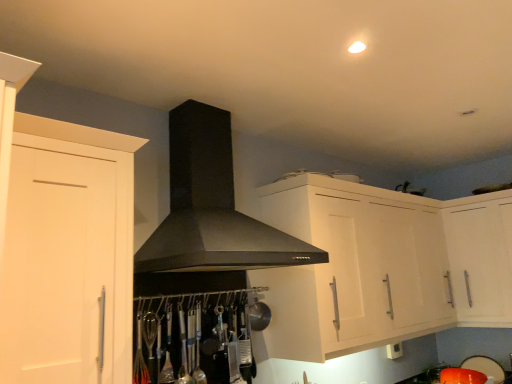
Question: Is white glossy cabinet at upper right, the 2th cabinetry in the left-to-right sequence, bigger than black matte fume hood at center?

Choices:
 (A) no
 (B) yes

Answer: (B)

Question: Does white glossy cabinet at upper right, the 2th cabinetry in the left-to-right sequence, have a smaller size compared to black matte fume hood at center?

Choices:
 (A) no
 (B) yes

Answer: (A)

Question: Is white glossy cabinet at upper right, which is the first cabinetry in back-to-front order, wider than black matte fume hood at center?

Choices:
 (A) yes
 (B) no

Answer: (B)

Question: Is white glossy cabinet at upper right, which is the first cabinetry in back-to-front order, not inside black matte fume hood at center?

Choices:
 (A) yes
 (B) no

Answer: (A)

Question: Are white glossy cabinet at upper right, the second cabinetry when ordered from front to back, and black matte fume hood at center beside each other?

Choices:
 (A) yes
 (B) no

Answer: (B)

Question: Considering the positions of orange matte bowl at lower right, which ranks as the second appliance in right-to-left order, and orange plastic bowl at lower right, the 2th appliance from the left, in the image, is orange matte bowl at lower right, which ranks as the second appliance in right-to-left order, wider or thinner than orange plastic bowl at lower right, the 2th appliance from the left,?

Choices:
 (A) wide
 (B) thin

Answer: (A)

Question: Is orange matte bowl at lower right, placed as the 1th appliance when sorted from left to right, inside the boundaries of orange plastic bowl at lower right, the 1th appliance in the right-to-left sequence, or outside?

Choices:
 (A) outside
 (B) inside

Answer: (A)

Question: Based on their sizes in the image, would you say orange matte bowl at lower right, placed as the 1th appliance when sorted from left to right, is bigger or smaller than orange plastic bowl at lower right, the 2th appliance from the left?

Choices:
 (A) big
 (B) small

Answer: (A)

Question: Considering the positions of orange matte bowl at lower right, which ranks as the second appliance in right-to-left order, and orange plastic bowl at lower right, the 1th appliance in the right-to-left sequence, in the image, is orange matte bowl at lower right, which ranks as the second appliance in right-to-left order, taller or shorter than orange plastic bowl at lower right, the 1th appliance in the right-to-left sequence,?

Choices:
 (A) tall
 (B) short

Answer: (B)

Question: In terms of width, does white glossy cabinet at upper right, which is the first cabinetry in back-to-front order, look wider or thinner when compared to white matte cabinet at left, which ranks as the 2th cabinetry in right-to-left order?

Choices:
 (A) wide
 (B) thin

Answer: (A)

Question: From the image's perspective, is white glossy cabinet at upper right, which is the first cabinetry in back-to-front order, above or below white matte cabinet at left, which ranks as the 2th cabinetry in right-to-left order?

Choices:
 (A) below
 (B) above

Answer: (A)

Question: Choose the correct answer: Is white glossy cabinet at upper right, the second cabinetry when ordered from front to back, inside white matte cabinet at left, which is the second cabinetry from back to front, or outside it?

Choices:
 (A) inside
 (B) outside

Answer: (B)

Question: Considering the positions of white glossy cabinet at upper right, the 2th cabinetry in the left-to-right sequence, and white matte cabinet at left, which is the second cabinetry from back to front, in the image, is white glossy cabinet at upper right, the 2th cabinetry in the left-to-right sequence, bigger or smaller than white matte cabinet at left, which is the second cabinetry from back to front,?

Choices:
 (A) big
 (B) small

Answer: (A)

Question: From a real-world perspective, is black matte fume hood at center positioned above or below orange matte bowl at lower right, which ranks as the second appliance in right-to-left order?

Choices:
 (A) above
 (B) below

Answer: (A)

Question: Is black matte fume hood at center wider or thinner than orange matte bowl at lower right, which ranks as the second appliance in right-to-left order?

Choices:
 (A) thin
 (B) wide

Answer: (B)